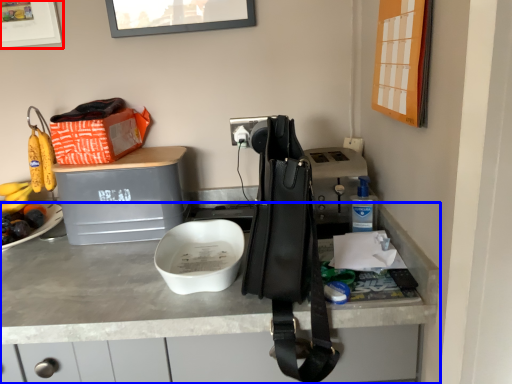
Question: Which object appears farthest to the camera in this image, picture frame (highlighted by a red box) or desk (highlighted by a blue box)?

Choices:
 (A) picture frame
 (B) desk

Answer: (A)